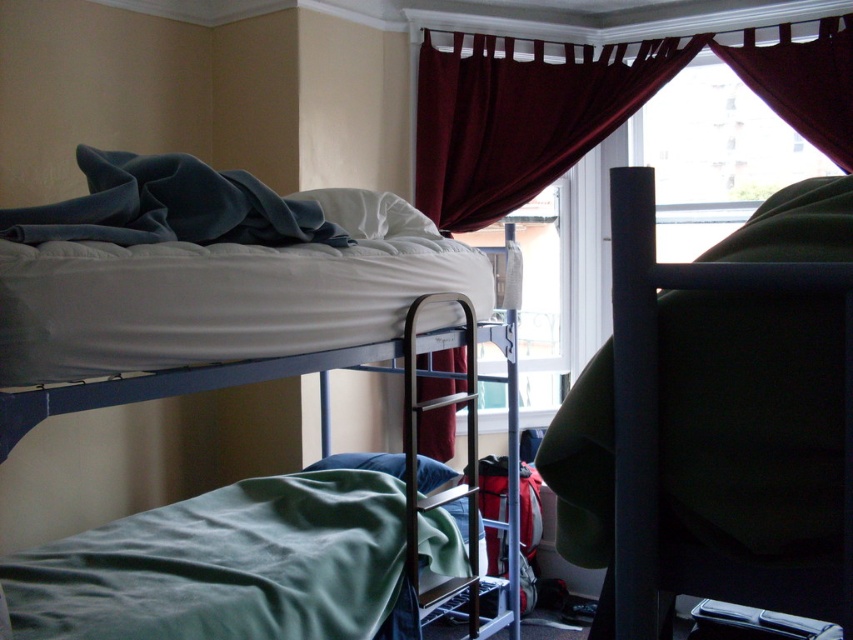
Does velvet burgundy curtain at upper center come in front of green fabric pillow at lower center?

No, velvet burgundy curtain at upper center is behind green fabric pillow at lower center.

Locate an element on the screen. Image resolution: width=853 pixels, height=640 pixels. velvet burgundy curtain at upper center is located at coordinates (592, 109).

Between point (340, 204) and point (343, 468), which one is positioned behind?

The point (343, 468) is behind.

Is white matte bunk bed at upper left below green fabric pillow at lower center?

Actually, white matte bunk bed at upper left is above green fabric pillow at lower center.

Is point (260, 337) more distant than point (431, 484)?

No, (260, 337) is in front of (431, 484).

The width and height of the screenshot is (853, 640). Identify the location of white matte bunk bed at upper left. (224, 294).

Which is behind, point (189, 317) or point (506, 378)?

Point (506, 378)

The width and height of the screenshot is (853, 640). In order to click on white matte bunk bed at upper left in this screenshot , I will do `click(224, 294)`.

Measure the distance between white matte bunk bed at upper left and camera.

white matte bunk bed at upper left and camera are 5.39 feet apart from each other.

Locate an element on the screen. white matte bunk bed at upper left is located at coordinates (224, 294).